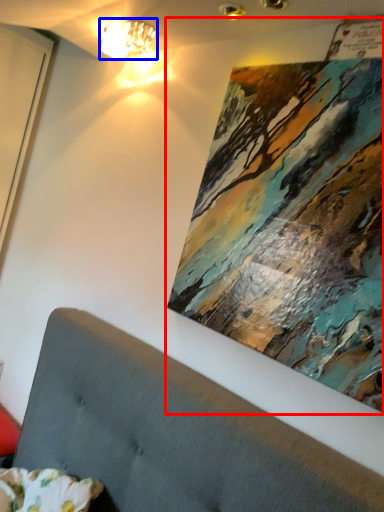
Question: Which point is further to the camera, picture frame (highlighted by a red box) or lamp (highlighted by a blue box)?

Choices:
 (A) picture frame
 (B) lamp

Answer: (B)